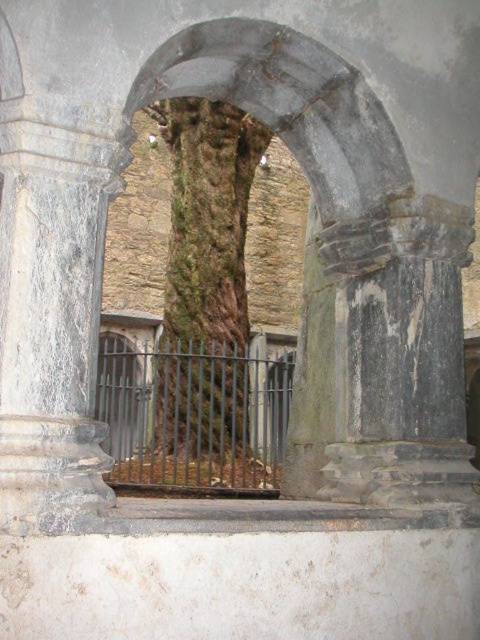
Question: Does rough stone archway at center appear under black metal fence at center?

Choices:
 (A) no
 (B) yes

Answer: (A)

Question: Which of the following is the closest to the observer?

Choices:
 (A) (194, 356)
 (B) (260, 234)

Answer: (A)

Question: Among these points, which one is nearest to the camera?

Choices:
 (A) (132, 456)
 (B) (336, 116)

Answer: (B)

Question: Is rough stone archway at center to the left of black metal fence at center from the viewer's perspective?

Choices:
 (A) no
 (B) yes

Answer: (A)

Question: Can you confirm if rough stone archway at center is positioned above black metal fence at center?

Choices:
 (A) no
 (B) yes

Answer: (B)